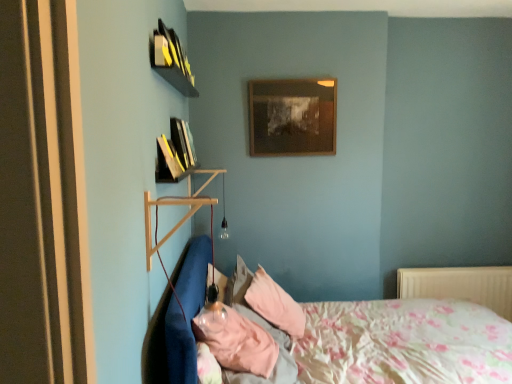
Measure the distance between white plastic radiator at lower right and camera.

white plastic radiator at lower right and camera are 10.36 feet apart from each other.

In order to face hardcover books at upper left, which is counted as the first book, starting from the front, should I rotate leftwards or rightwards?

Rotate left and turn 9.617 degrees.

At what (x,y) coordinates should I click in order to perform the action: click on white plastic radiator at lower right. Please return your answer as a coordinate pair (x, y). Looking at the image, I should click on (460, 285).

Is wooden picture frame at upper center thinner than pink fabric pillow at lower center?

Yes.

From the picture: Who is more distant, wooden picture frame at upper center or pink fabric pillow at lower center?

wooden picture frame at upper center is further away from the camera.

Between floral fabric bed at lower right and white plastic radiator at lower right, which one has larger size?

floral fabric bed at lower right.

Could you tell me if floral fabric bed at lower right is facing white plastic radiator at lower right?

No, floral fabric bed at lower right is not aimed at white plastic radiator at lower right.

In the scene shown: In the image, is floral fabric bed at lower right on the left side or the right side of white plastic radiator at lower right?

In the image, floral fabric bed at lower right appears on the left side of white plastic radiator at lower right.

Does floral fabric bed at lower right touch white plastic radiator at lower right?

floral fabric bed at lower right and white plastic radiator at lower right are not in contact.

Is wooden shelf at left bigger or smaller than pink fabric pillow at lower center?

Clearly, wooden shelf at left is smaller in size than pink fabric pillow at lower center.

In terms of width, does wooden shelf at left look wider or thinner when compared to pink fabric pillow at lower center?

wooden shelf at left is thinner than pink fabric pillow at lower center.

Based on the photo, which of these two, wooden shelf at left or pink fabric pillow at lower center, stands taller?

Standing taller between the two is wooden shelf at left.

Considering the relative positions of wooden picture frame at upper center and hardcover book at upper left, which ranks as the 1th book in back-to-front order, in the image provided, is wooden picture frame at upper center to the left of hardcover book at upper left, which ranks as the 1th book in back-to-front order, from the viewer's perspective?

In fact, wooden picture frame at upper center is to the right of hardcover book at upper left, which ranks as the 1th book in back-to-front order.

You are a GUI agent. You are given a task and a screenshot of the screen. Output one action in this format:
    pyautogui.click(x=<x>, y=<y>)
    Task: Click on the book that is the 2nd one below the wooden picture frame at upper center (from a real-world perspective)
    
    Given the screenshot: What is the action you would take?
    pyautogui.click(x=167, y=162)

Measure the distance from wooden picture frame at upper center to hardcover book at upper left, placed as the 2th book when sorted from front to back.

wooden picture frame at upper center and hardcover book at upper left, placed as the 2th book when sorted from front to back, are 3.61 feet apart from each other.

How many degrees apart are the facing directions of wooden picture frame at upper center and hardcover book at upper left, placed as the 2th book when sorted from front to back?

89.9 degrees.

In terms of width, does floral fabric bed at lower right look wider or thinner when compared to wooden picture frame at upper center?

Considering their sizes, floral fabric bed at lower right looks broader than wooden picture frame at upper center.

From a real-world perspective, relative to wooden picture frame at upper center, is floral fabric bed at lower right vertically above or below?

From a real-world perspective, floral fabric bed at lower right is physically below wooden picture frame at upper center.

Is point (417, 332) farther from viewer compared to point (289, 155)?

No, (417, 332) is in front of (289, 155).

Can you confirm if floral fabric bed at lower right is smaller than wooden picture frame at upper center?

Incorrect, floral fabric bed at lower right is not smaller in size than wooden picture frame at upper center.

Between hardcover books at upper left, which is counted as the first book, starting from the front, and wooden picture frame at upper center, which one has larger size?

With larger size is hardcover books at upper left, which is counted as the first book, starting from the front.

Is hardcover books at upper left, which is counted as the first book, starting from the front, not inside wooden picture frame at upper center?

Yes, hardcover books at upper left, which is counted as the first book, starting from the front, is outside of wooden picture frame at upper center.

Does point (163, 181) come farther from viewer compared to point (248, 86)?

No, it is not.

Considering the sizes of hardcover books at upper left, the 2th book viewed from the back, and wooden picture frame at upper center in the image, is hardcover books at upper left, the 2th book viewed from the back, taller or shorter than wooden picture frame at upper center?

In the image, hardcover books at upper left, the 2th book viewed from the back, appears to be shorter than wooden picture frame at upper center.

Considering the sizes of hardcover book at upper left, which ranks as the 1th book in back-to-front order, and pink fabric pillow at lower center in the image, is hardcover book at upper left, which ranks as the 1th book in back-to-front order, wider or thinner than pink fabric pillow at lower center?

Clearly, hardcover book at upper left, which ranks as the 1th book in back-to-front order, has less width compared to pink fabric pillow at lower center.

From a real-world perspective, is hardcover book at upper left, placed as the 2th book when sorted from front to back, positioned under pink fabric pillow at lower center based on gravity?

No, from a real-world perspective, hardcover book at upper left, placed as the 2th book when sorted from front to back, is not under pink fabric pillow at lower center.

Does hardcover book at upper left, which ranks as the 1th book in back-to-front order, turn towards pink fabric pillow at lower center?

No, hardcover book at upper left, which ranks as the 1th book in back-to-front order, is not aimed at pink fabric pillow at lower center.

At what (x,y) coordinates should I click in order to perform the action: click on picture frame lying behind the pink fabric pillow at lower center. Please return your answer as a coordinate pair (x, y). The height and width of the screenshot is (384, 512). Looking at the image, I should click on (292, 117).

The image size is (512, 384). I want to click on radiator on the right of the floral fabric bed at lower right, so click(460, 285).

Considering their positions, is pink fabric pillow at lower center positioned closer to wooden picture frame at upper center than hardcover book at upper left, placed as the 2th book when sorted from front to back?

Among the two, hardcover book at upper left, placed as the 2th book when sorted from front to back, is located nearer to wooden picture frame at upper center.

From the image, which object appears to be farther from wooden picture frame at upper center, floral fabric bed at lower right or white plastic radiator at lower right?

Based on the image, white plastic radiator at lower right appears to be further to wooden picture frame at upper center.

When comparing their distances from white plastic radiator at lower right, does floral fabric bed at lower right or hardcover books at upper left, the 2th book viewed from the back, seem closer?

floral fabric bed at lower right.

Based on their spatial positions, is floral fabric bed at lower right or pink fabric pillow at lower center further from wooden picture frame at upper center?

Among the two, floral fabric bed at lower right is located further to wooden picture frame at upper center.

Which object lies further to the anchor point hardcover books at upper left, the 2th book viewed from the back, wooden shelf at left or hardcover book at upper left, which ranks as the 1th book in back-to-front order?

wooden shelf at left.

Based on their spatial positions, is floral fabric bed at lower right or hardcover book at upper left, placed as the 2th book when sorted from front to back, closer to white plastic radiator at lower right?

floral fabric bed at lower right.

Consider the image. Estimate the real-world distances between objects in this image. Which object is closer to wooden shelf at left, hardcover book at upper left, placed as the 2th book when sorted from front to back, or floral fabric bed at lower right?

Based on the image, hardcover book at upper left, placed as the 2th book when sorted from front to back, appears to be nearer to wooden shelf at left.

From the image, which object appears to be farther from wooden shelf at left, pink fabric pillow at lower center or white plastic radiator at lower right?

Among the two, white plastic radiator at lower right is located further to wooden shelf at left.

Find the location of a particular element. The height and width of the screenshot is (384, 512). pillow between hardcover books at upper left, the 2th book viewed from the back, and white plastic radiator at lower right, in the horizontal direction is located at coordinates (275, 304).

At what (x,y) coordinates should I click in order to perform the action: click on pillow between floral fabric bed at lower right and white plastic radiator at lower right from front to back. Please return your answer as a coordinate pair (x, y). The height and width of the screenshot is (384, 512). Looking at the image, I should click on (275, 304).

This screenshot has height=384, width=512. What are the coordinates of `book located between hardcover books at upper left, which is counted as the first book, starting from the front, and wooden picture frame at upper center in the depth direction` in the screenshot? It's located at (167, 162).

Identify the location of picture frame between pink fabric pillow at lower center and white plastic radiator at lower right in the horizontal direction. The width and height of the screenshot is (512, 384). (292, 117).